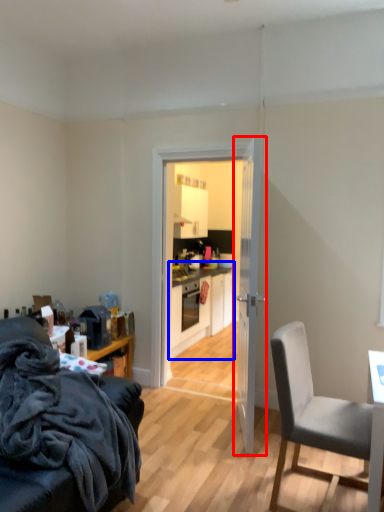
Question: Which object is further to the camera taking this photo, door (highlighted by a red box) or cabinetry (highlighted by a blue box)?

Choices:
 (A) door
 (B) cabinetry

Answer: (B)